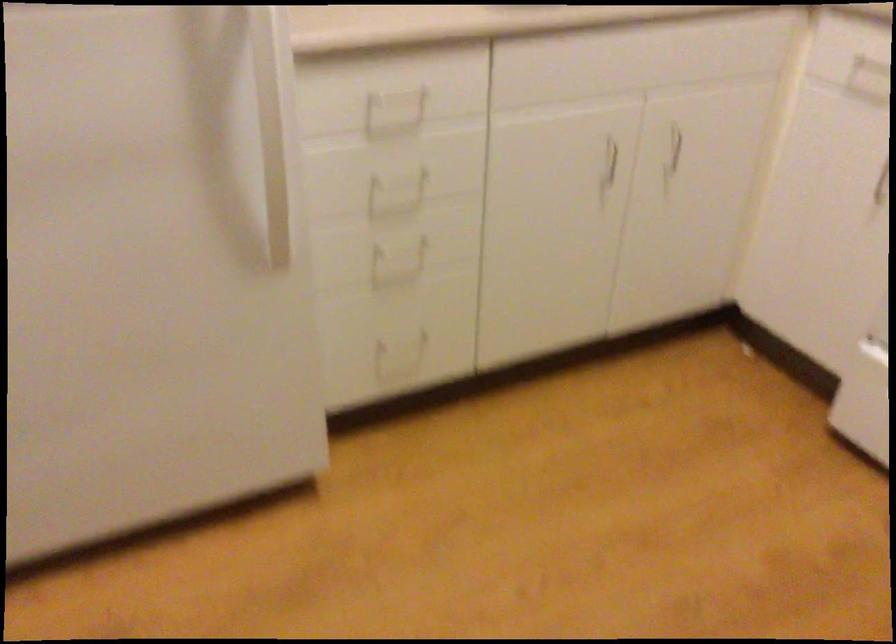
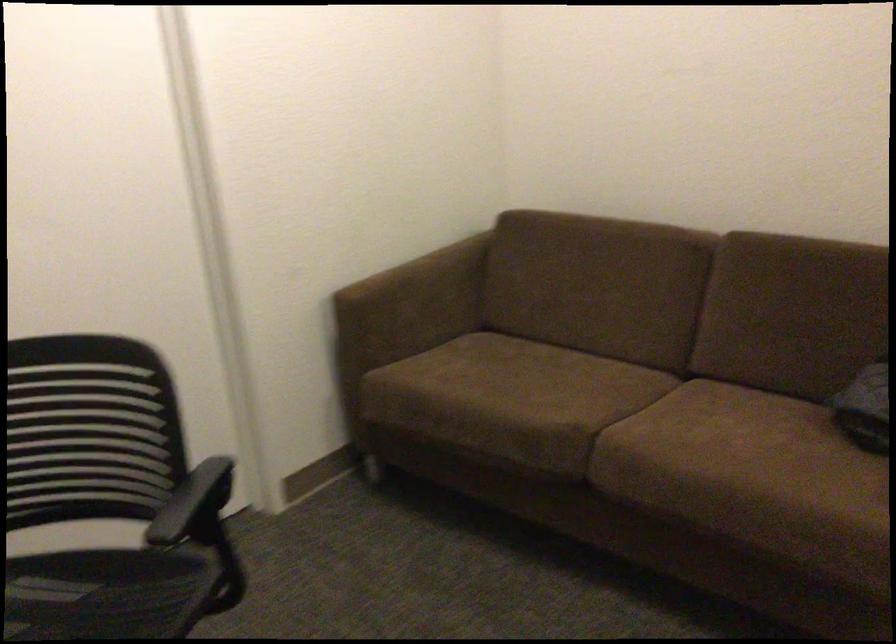
Question: The camera is either moving clockwise (left) or counter-clockwise (right) around the object. The first image is from the beginning of the video and the second image is from the end. Is the camera moving left or right when shooting the video?

Choices:
 (A) Left
 (B) Right

Answer: (B)